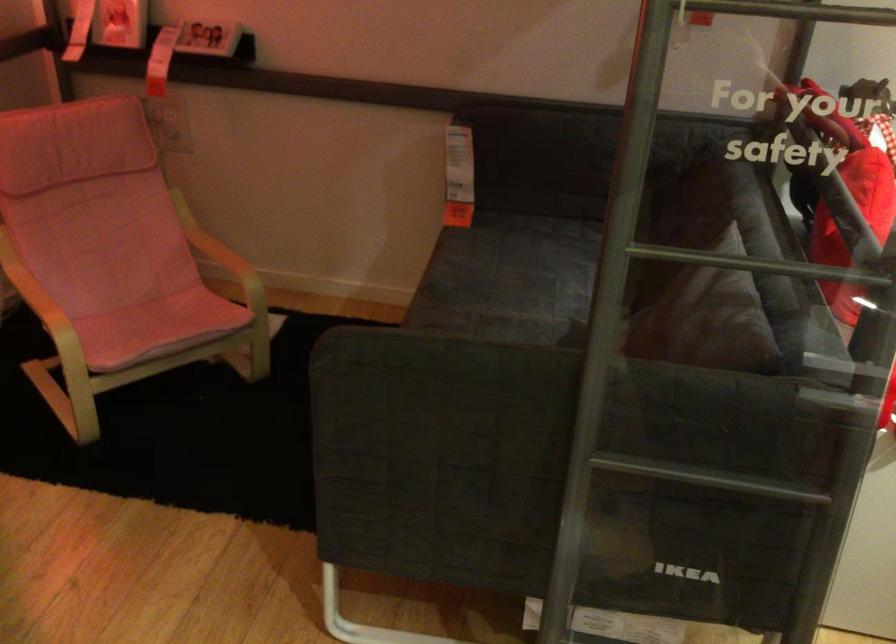
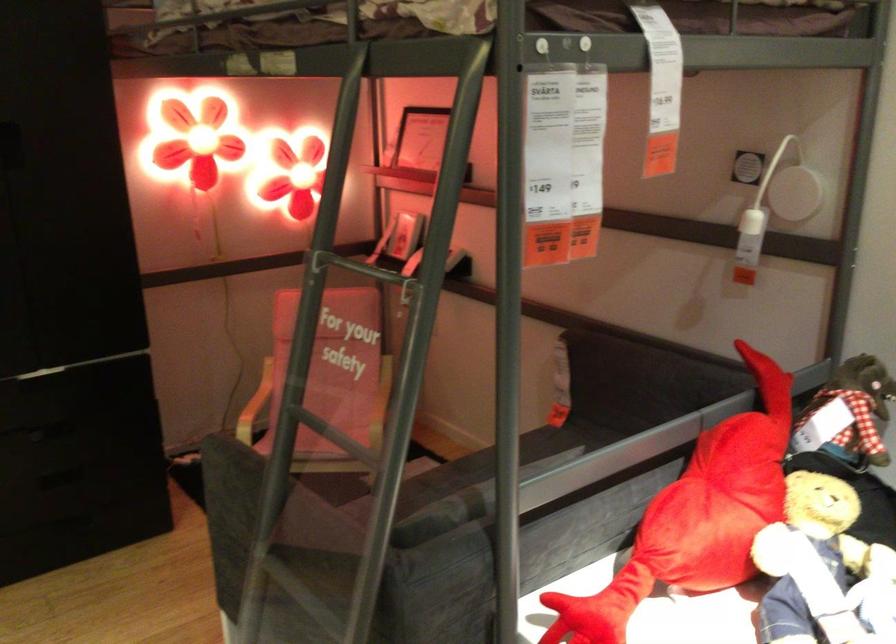
In the second image, find the point that corresponds to point 140,267 in the first image.

(331, 404)